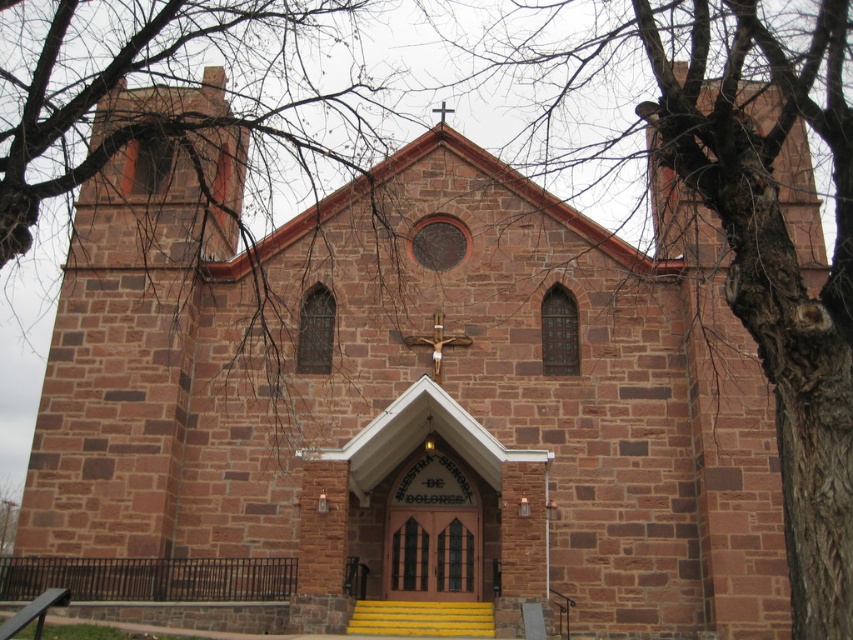
You are standing in front of the church and want to take a photo of the bark textured tree at upper center and the yellow painted wood stairs at center. Which object should you zoom in more on to capture both in the frame without cropping?

You should zoom in more on the yellow painted wood stairs at center because the bark textured tree at upper center is larger in size, so zooming in on the smaller object allows both to fit in the frame.

You are a visitor standing in front of the church and notice two trees in the scene. The first is the bare branches at center, and the second is the bark textured tree at upper center. Which of these trees is positioned higher up in the image?

The bark textured tree at upper center is positioned higher up in the image than the bare branches at center.